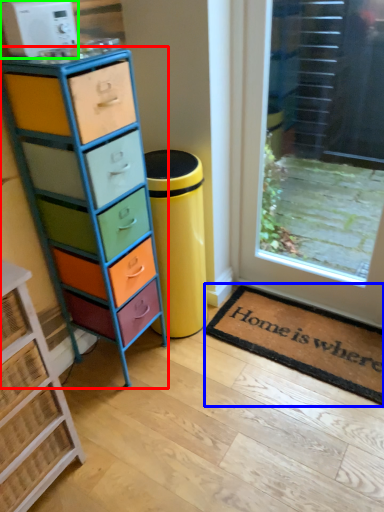
Question: Estimate the real-world distances between objects in this image. Which object is closer to chest of drawers (highlighted by a red box), doormat (highlighted by a blue box) or appliance (highlighted by a green box)?

Choices:
 (A) doormat
 (B) appliance

Answer: (B)